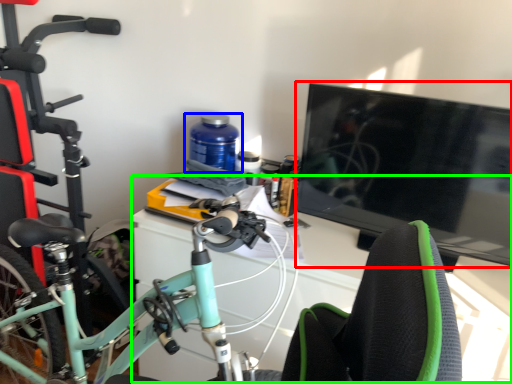
Question: Which is farther away from television (highlighted by a red box)? bottle (highlighted by a blue box) or computer desk (highlighted by a green box)?

Choices:
 (A) bottle
 (B) computer desk

Answer: (A)